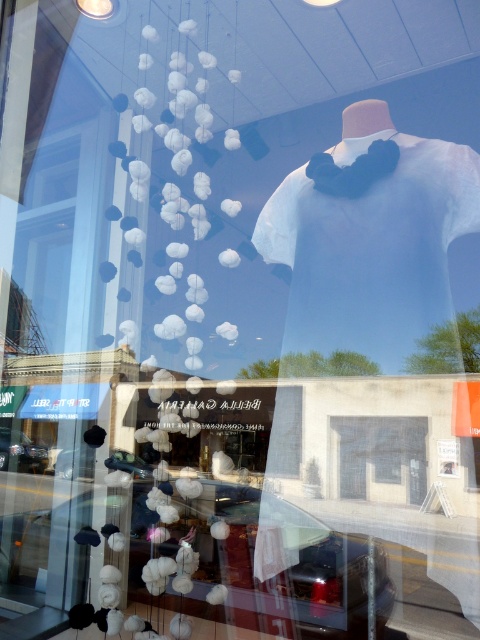
Question: Does shiny black car at lower center have a greater width compared to shiny black car at lower left?

Choices:
 (A) no
 (B) yes

Answer: (B)

Question: Which of the following is the farthest from the observer?

Choices:
 (A) white matte t-shirt at center
 (B) transparent glass door at center

Answer: (B)

Question: Does shiny black car at lower left appear on the left side of metallic silver car at lower center?

Choices:
 (A) yes
 (B) no

Answer: (A)

Question: From the image, what is the correct spatial relationship of shiny black car at lower left in relation to metallic silver car at lower center?

Choices:
 (A) below
 (B) above

Answer: (A)

Question: Among these points, which one is farthest from the camera?

Choices:
 (A) (228, 614)
 (B) (10, 451)
 (C) (118, 454)

Answer: (B)

Question: Which object appears closest to the camera in this image?

Choices:
 (A) metallic silver car at lower center
 (B) transparent glass door at center
 (C) shiny black car at lower left
 (D) shiny black car at lower center

Answer: (D)